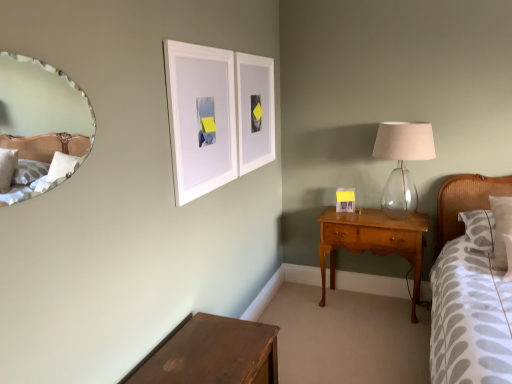
At what (x,y) coordinates should I click in order to perform the action: click on free region under light brown wood nightstand at center right (from a real-world perspective). Please return your answer as a coordinate pair (x, y). This screenshot has height=384, width=512. Looking at the image, I should click on (371, 303).